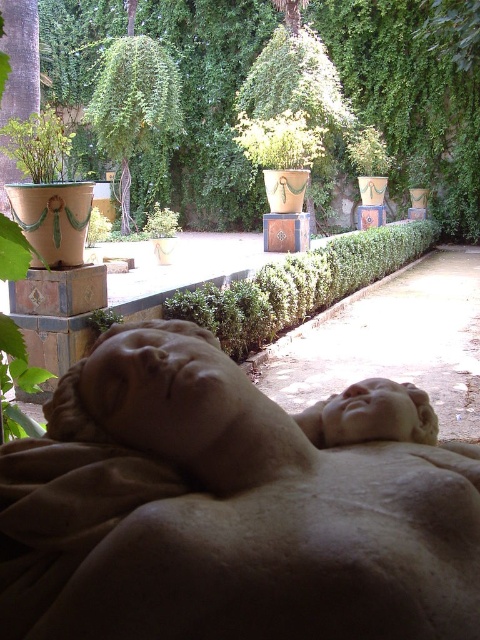
Who is lower down, smooth beige statue at center or green leafy plant at lower left?

smooth beige statue at center is below.

Which is above, smooth beige statue at center or green leafy plant at lower left?

green leafy plant at lower left is higher up.

Which is in front, point (54, 428) or point (104, 323)?

Point (54, 428)

This screenshot has height=640, width=480. What are the coordinates of `smooth beige statue at center` in the screenshot? It's located at (225, 512).

Is point (238, 445) closer to camera compared to point (393, 131)?

Yes, point (238, 445) is closer to viewer.

Between point (285, 465) and point (44, 68), which one is positioned behind?

Positioned behind is point (44, 68).

Is point (82, 374) closer to camera compared to point (217, 74)?

Yes.

The image size is (480, 640). I want to click on smooth beige statue at center, so click(225, 512).

Does green leafy hedge at upper center have a smaller size compared to green leafy plant at lower left?

No.

Who is positioned more to the right, green leafy hedge at upper center or green leafy plant at lower left?

From the viewer's perspective, green leafy hedge at upper center appears more on the right side.

The width and height of the screenshot is (480, 640). What are the coordinates of `green leafy hedge at upper center` in the screenshot? It's located at (410, 99).